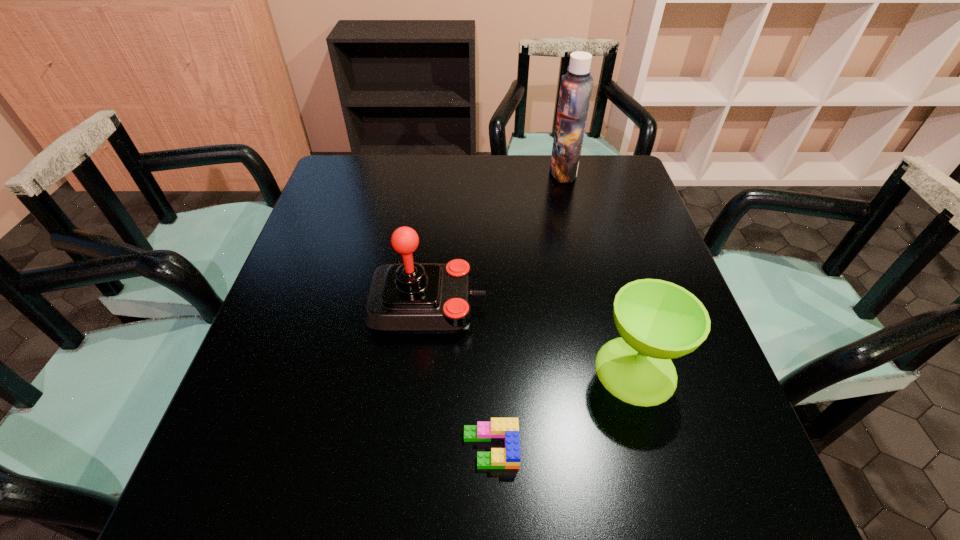
You are a GUI agent. You are given a task and a screenshot of the screen. Output one action in this format:
    pyautogui.click(x=<x>, y=<y>)
    Task: Click on the vacant region located on the left of the wineglass
    
    Given the screenshot: What is the action you would take?
    pyautogui.click(x=470, y=370)

Identify the location of vacant area situated 0.260m on the right of the nearest object. The width and height of the screenshot is (960, 540). (667, 448).

You are a GUI agent. You are given a task and a screenshot of the screen. Output one action in this format:
    pyautogui.click(x=<x>, y=<y>)
    Task: Click on the object at the far edge
    
    Given the screenshot: What is the action you would take?
    pos(576,85)

Image resolution: width=960 pixels, height=540 pixels. What are the coordinates of `object that is at the near edge` in the screenshot? It's located at (506, 430).

Locate an element on the screen. This screenshot has height=540, width=960. shampoo at the right edge is located at coordinates (576, 85).

I want to click on wineglass located in the right edge section of the desktop, so click(657, 320).

Where is `object at the far right corner`? Image resolution: width=960 pixels, height=540 pixels. object at the far right corner is located at coordinates coord(576,85).

The width and height of the screenshot is (960, 540). In order to click on free space at the far edge of the desktop in this screenshot , I will do `click(486, 164)`.

Locate an element on the screen. vacant area at the near edge is located at coordinates point(448,505).

Identify the location of blank space at the left edge of the desktop. (276, 298).